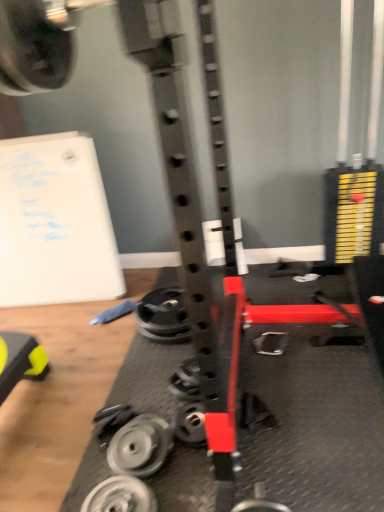
This screenshot has width=384, height=512. I want to click on free space that is to the left of metallic silver weight at center, which appears as the fourth wheel when viewed from the front, so click(100, 338).